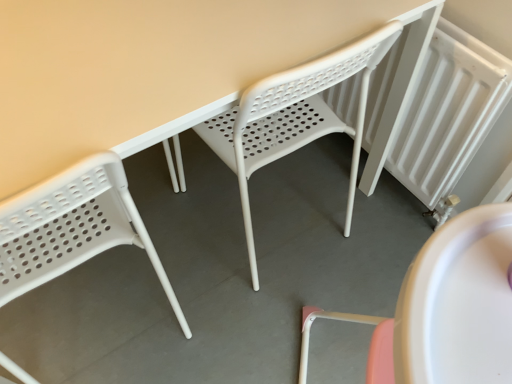
Find the location of a particular element. This screenshot has height=384, width=512. vacant region below white plastic chair at center, which is counted as the second chair, starting from the left (from a real-world perspective) is located at coordinates (268, 214).